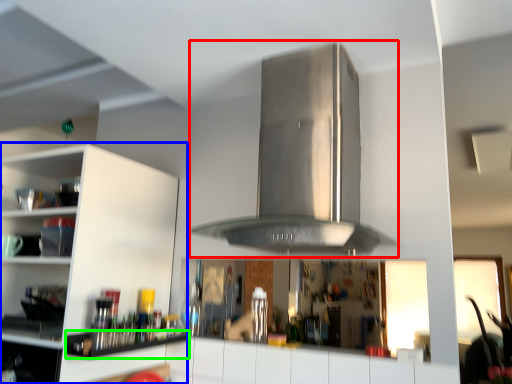
Question: Which object is positioned closest to vent (highlighted by a red box)? Select from cabinetry (highlighted by a blue box) and shelf (highlighted by a green box).

Choices:
 (A) cabinetry
 (B) shelf

Answer: (A)